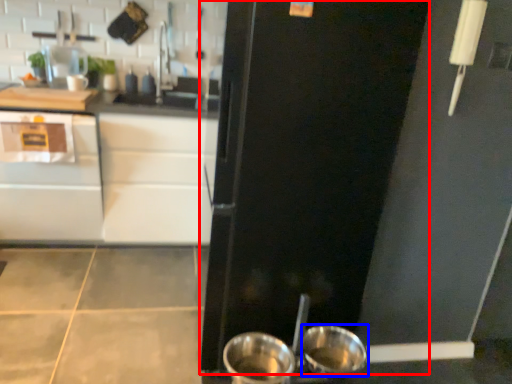
Question: Which object is further to the camera taking this photo, door (highlighted by a red box) or basin (highlighted by a blue box)?

Choices:
 (A) door
 (B) basin

Answer: (B)